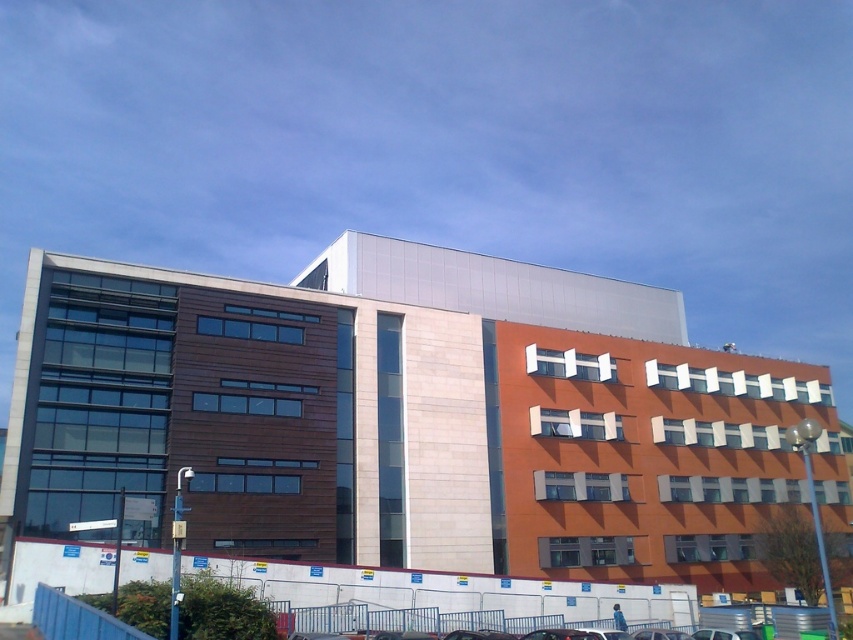
Is point (474, 637) positioned behind point (680, 636)?

No, (474, 637) is in front of (680, 636).

Who is taller, metallic silver car at lower center or shiny black car at center?

With more height is metallic silver car at lower center.

I want to click on metallic silver car at lower center, so click(x=699, y=634).